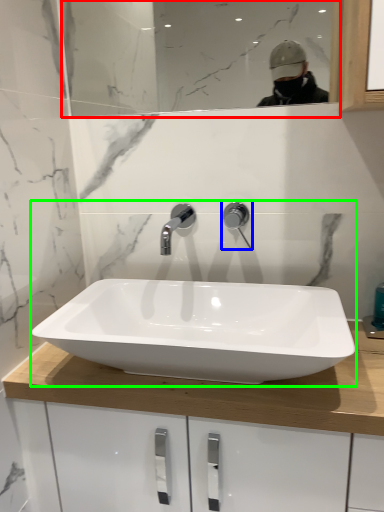
Question: Estimate the real-world distances between objects in this image. Which object is closer to mirror (highlighted by a red box), tap (highlighted by a blue box) or sink (highlighted by a green box)?

Choices:
 (A) tap
 (B) sink

Answer: (B)